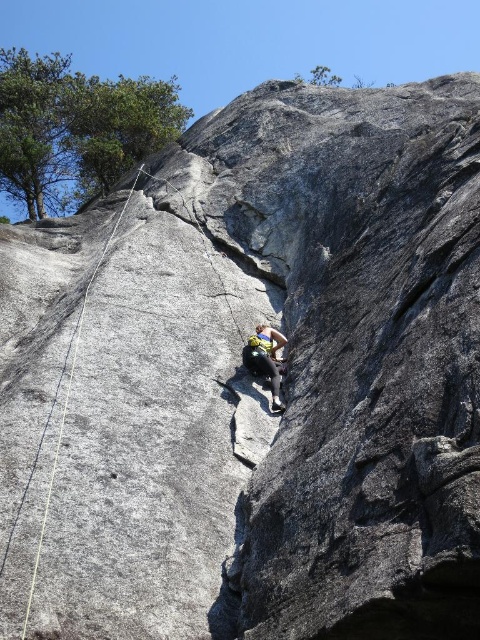
Based on the scene description, where is the yellow nylon rope at left located in the image?

The yellow nylon rope at left is located at the point with coordinates 0.623 on the x axis and 0.142 on the y axis.

You are a rock climber preparing to secure your equipment. You have a yellow nylon rope at left and a yellow climbing harness at center. Which of these two items is bigger in size?

The yellow nylon rope at left is larger in size than the yellow climbing harness at center.

You are a rock climber trying to reach the top of the granite face. You notice two points marked on the rock. Which point is closer to you, point (x=38, y=560) or point (x=251, y=339)?

Point (x=38, y=560) is closer to you than point (x=251, y=339).